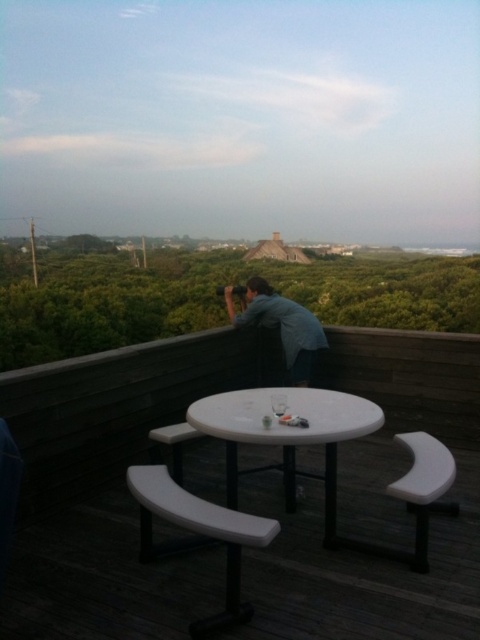
Question: Among these points, which one is nearest to the camera?

Choices:
 (A) (267, 285)
 (B) (220, 410)

Answer: (B)

Question: Which object is farther from the camera taking this photo?

Choices:
 (A) white plastic picnic table at center
 (B) blue denim shirt at upper center

Answer: (B)

Question: Does white plastic picnic table at center come in front of blue denim shirt at upper center?

Choices:
 (A) no
 (B) yes

Answer: (B)

Question: Can you confirm if white plastic picnic table at center is positioned above blue denim shirt at upper center?

Choices:
 (A) no
 (B) yes

Answer: (A)

Question: Can you confirm if white plastic picnic table at center is positioned to the right of blue denim shirt at upper center?

Choices:
 (A) yes
 (B) no

Answer: (B)

Question: Which point is closer to the camera?

Choices:
 (A) (383, 413)
 (B) (297, 348)

Answer: (A)